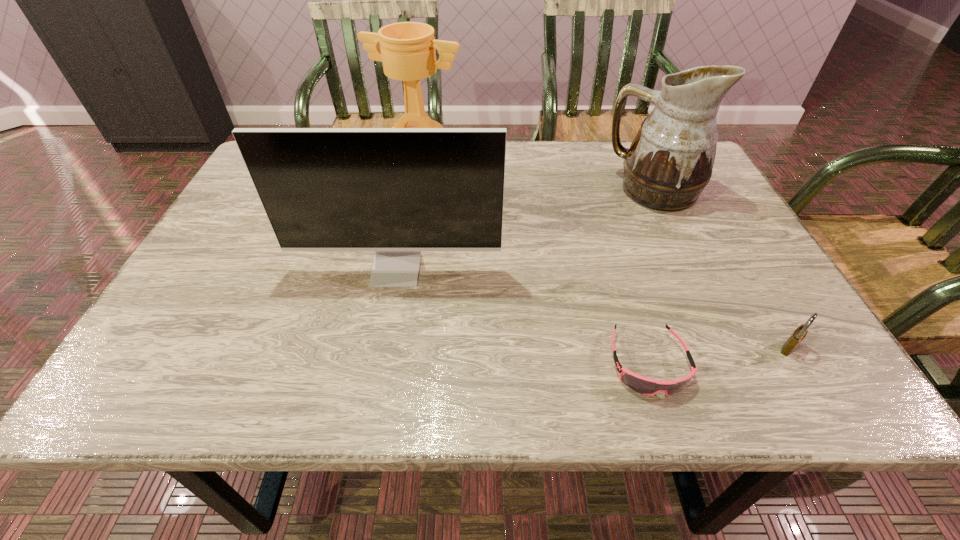
This screenshot has height=540, width=960. I want to click on award, so click(x=408, y=49).

Where is `pitcher`? This screenshot has height=540, width=960. pitcher is located at coordinates (670, 160).

Identify the location of monitor. click(x=397, y=191).

Image resolution: width=960 pixels, height=540 pixels. What are the coordinates of `padlock` in the screenshot? It's located at (799, 334).

Locate an element on the screen. The height and width of the screenshot is (540, 960). goggles is located at coordinates (646, 386).

Locate an element on the screen. The image size is (960, 540). free point located on the left of the award is located at coordinates (326, 164).

Find the location of a particular element. The width and height of the screenshot is (960, 540). vacant area located 0.120m from the spout of the pitcher is located at coordinates (561, 190).

Find the location of a particular element. The image size is (960, 540). free region located from the spout of the pitcher is located at coordinates (521, 190).

Find the location of a particular element. This screenshot has height=540, width=960. vacant space situated from the spout of the pitcher is located at coordinates (498, 190).

You are a GUI agent. You are given a task and a screenshot of the screen. Output one action in this format:
    pyautogui.click(x=<x>, y=<y>)
    Task: Click on the free space located 0.180m on the front-facing side of the third farthest object
    The image size is (960, 540).
    Given the screenshot: What is the action you would take?
    pyautogui.click(x=378, y=362)